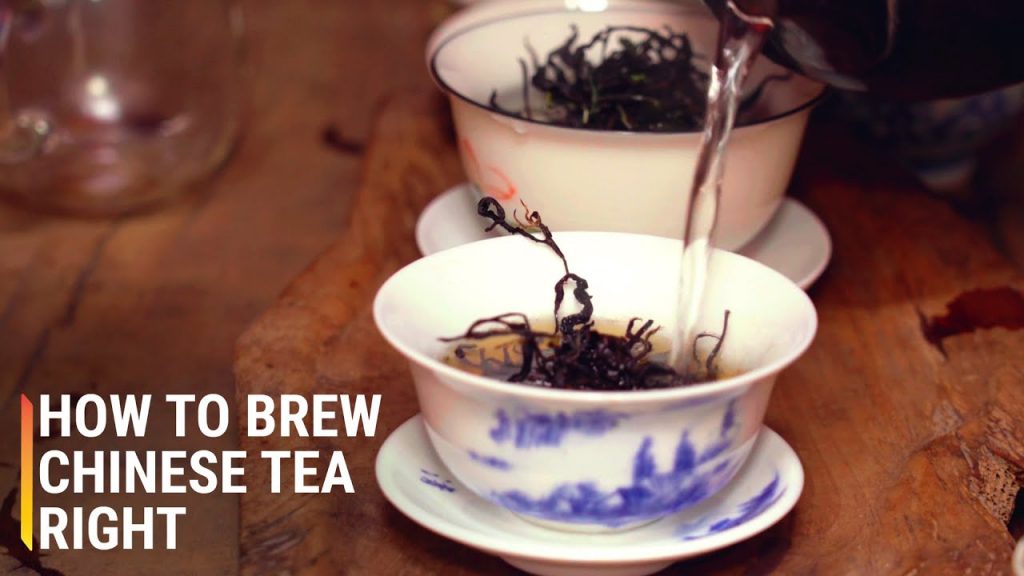
At what (x,y) coordinates should I click in order to perform the action: click on tea cup. Please return your answer as a coordinate pair (x, y). Image resolution: width=1024 pixels, height=576 pixels. Looking at the image, I should click on (609, 270), (590, 174).